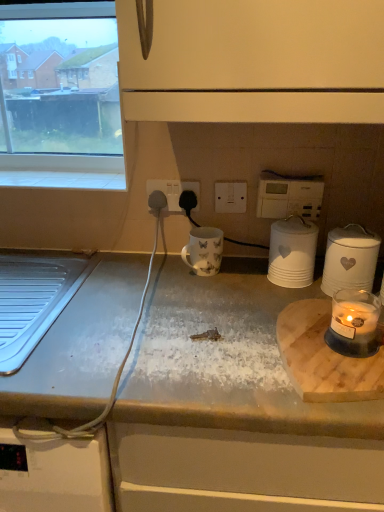
Find the location of a particular element. This screenshot has width=384, height=512. free space between white matte canister at center-right, the first kitchen appliance when ordered from left to right, and white glossy mug at center is located at coordinates (243, 277).